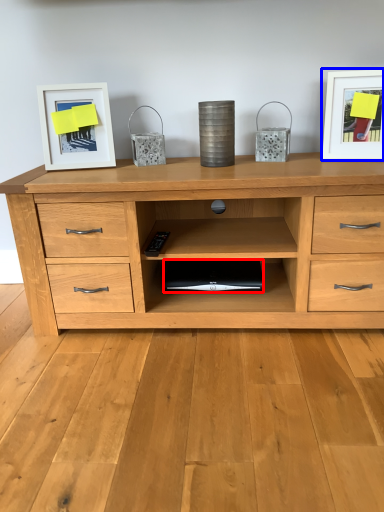
Question: Which point is closer to the camera, computer (highlighted by a red box) or picture frame (highlighted by a blue box)?

Choices:
 (A) computer
 (B) picture frame

Answer: (B)